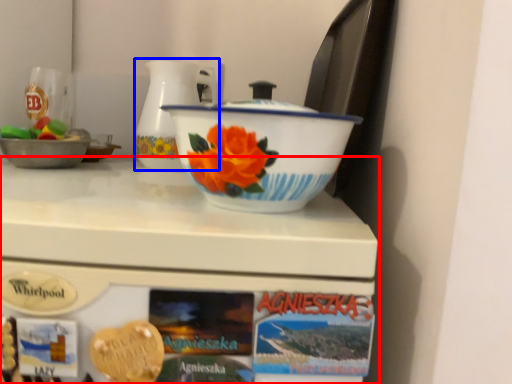
Question: Which of the following is the farthest to the observer, table (highlighted by a red box) or jug (highlighted by a blue box)?

Choices:
 (A) table
 (B) jug

Answer: (B)